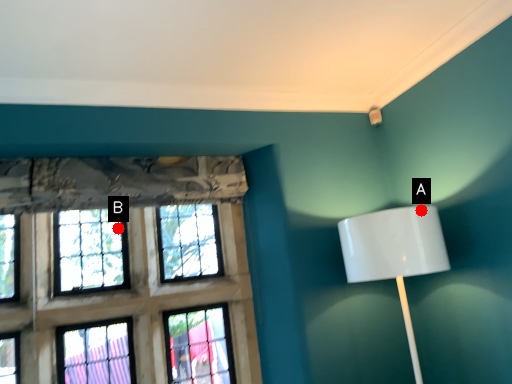
Question: Two points are circled on the image, labeled by A and B beside each circle. Which point appears closest to the camera in this image?

Choices:
 (A) A is closer
 (B) B is closer

Answer: (A)